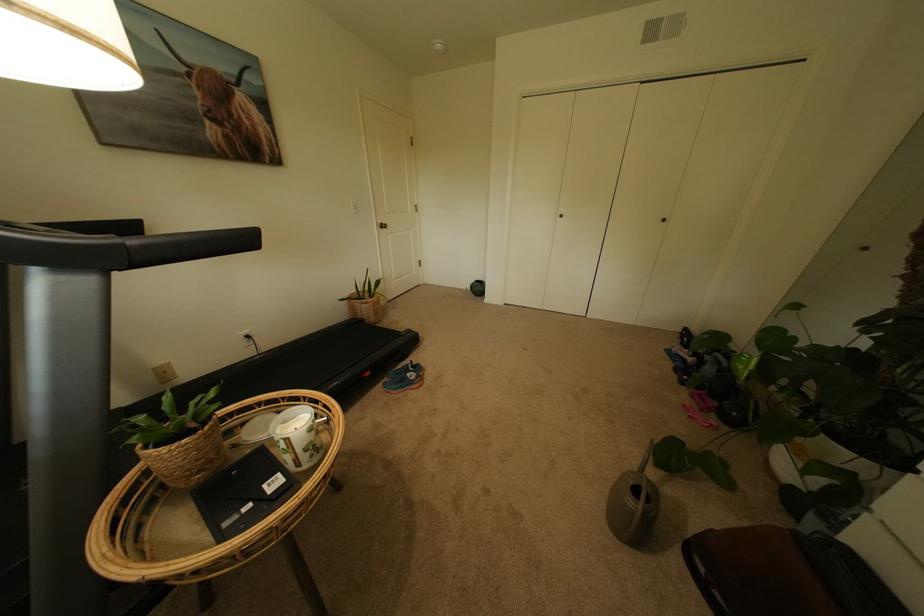
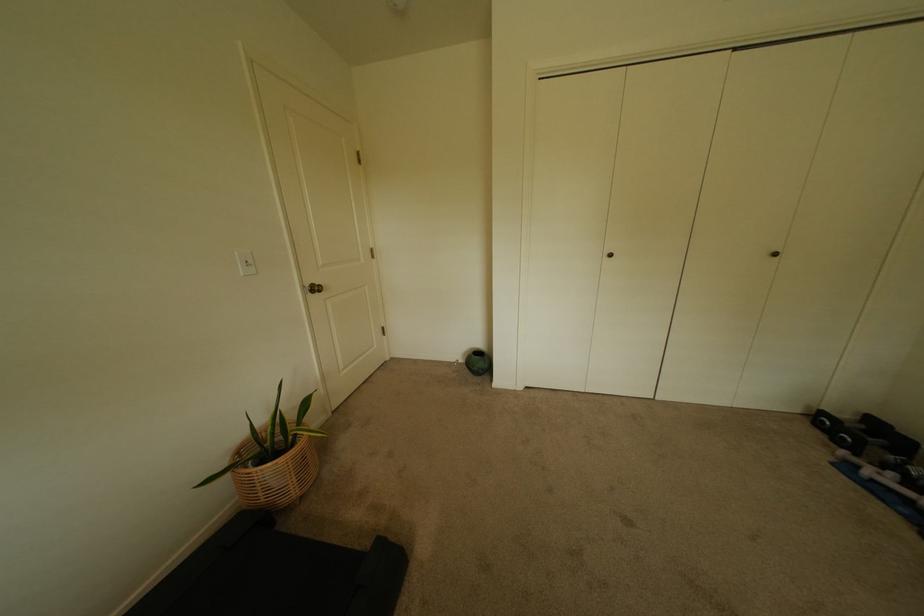
In the second image, find the point that corresponds to (x=673, y=222) in the first image.

(784, 256)